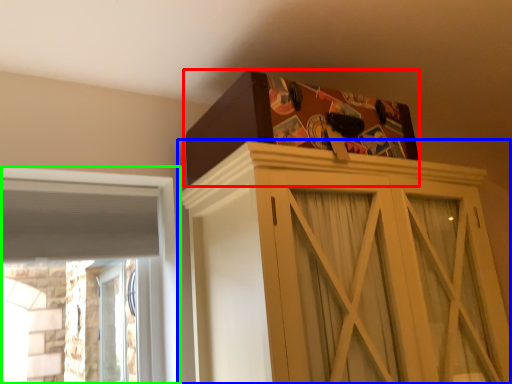
Question: Which object is positioned farthest from cardboard box (highlighted by a red box)? Select from cupboard (highlighted by a blue box) and window (highlighted by a green box).

Choices:
 (A) cupboard
 (B) window

Answer: (B)